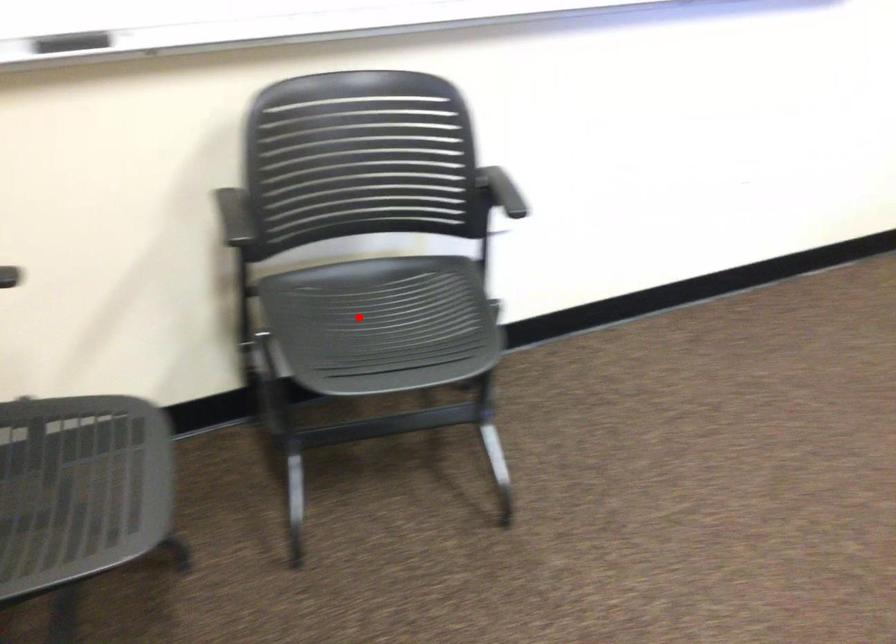
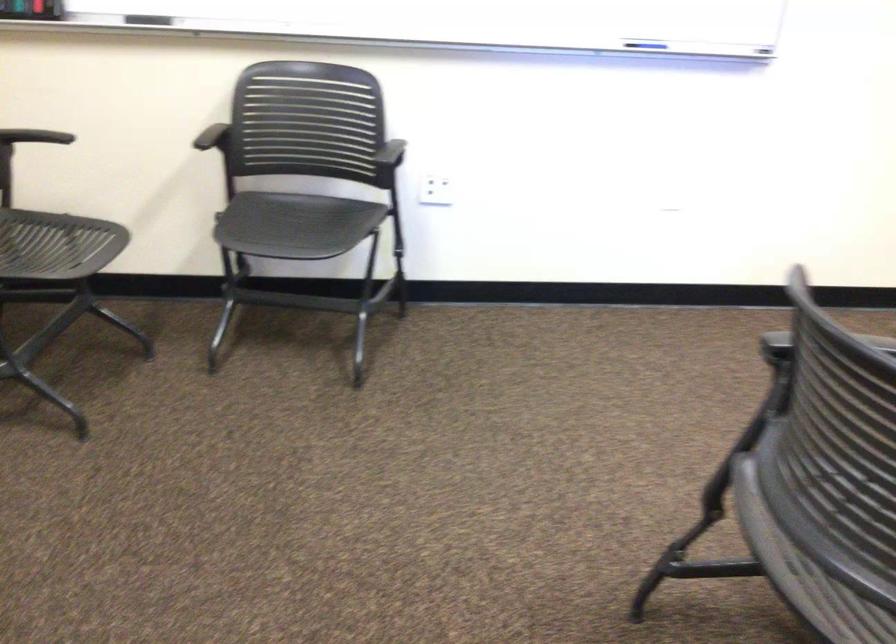
Question: I am providing you with two images of the same scene from different viewpoints. In image1, a red point is highlighted. Considering the same 3D point in image2, which of the following is correct?

Choices:
 (A) It is closer
 (B) It is farther

Answer: (B)